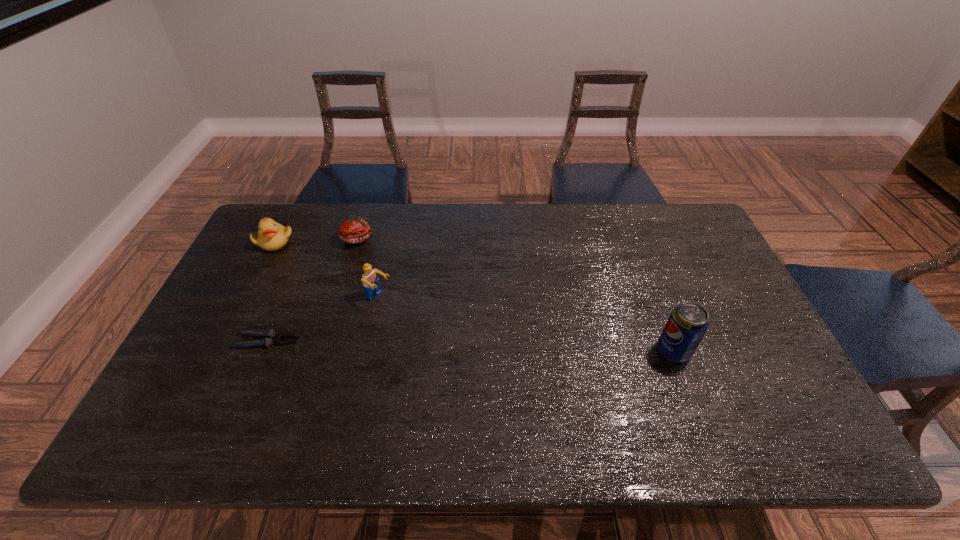
Locate an element on the screen. The height and width of the screenshot is (540, 960). free space on the desktop that is between the shortest object and the soda and is positioned on the front-facing side of the third object from right to left is located at coordinates (440, 345).

Identify the location of free space on the desktop that is between the pliers and the tallest object and is positioned on the face of the second tallest object. pos(457,346).

Where is `vacant space on the desktop that is between the pliers and the tallest object and is positioned on the beak of the duckling`? vacant space on the desktop that is between the pliers and the tallest object and is positioned on the beak of the duckling is located at coordinates (411, 345).